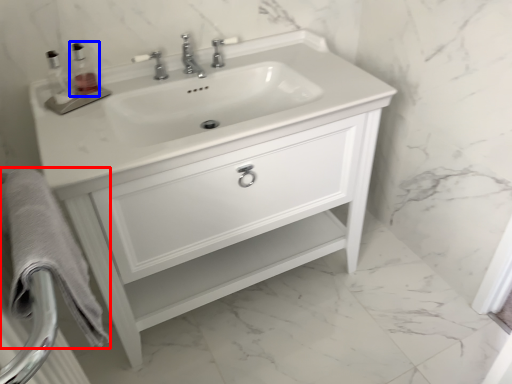
Question: Among these objects, which one is farthest to the camera, bath towel (highlighted by a red box) or soap dispenser (highlighted by a blue box)?

Choices:
 (A) bath towel
 (B) soap dispenser

Answer: (B)